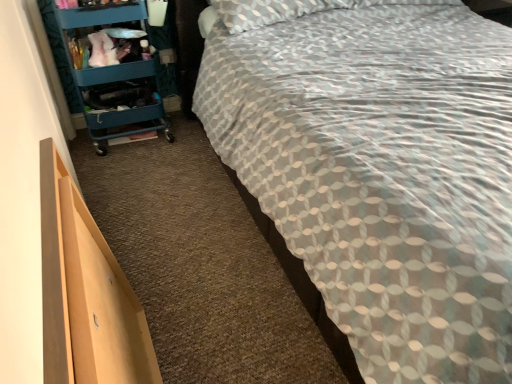
The image size is (512, 384). Find the location of `free point below teal plastic cart at left (from a real-world perspective)`. free point below teal plastic cart at left (from a real-world perspective) is located at coordinates (126, 143).